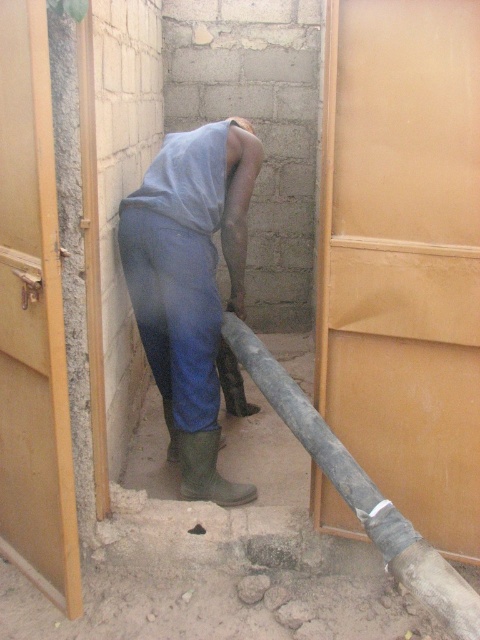
Question: Can you confirm if rusty metallic pipe at center is positioned to the right of green rubber boot at lower center?

Choices:
 (A) no
 (B) yes

Answer: (B)

Question: Which of the following is the closest to the observer?

Choices:
 (A) rusty metallic pipe at center
 (B) blue denim pants at center
 (C) smooth concrete hole at lower center
 (D) green rubber boot at lower center

Answer: (A)

Question: Estimate the real-world distances between objects in this image. Which object is closer to the rusty metallic pipe at center?

Choices:
 (A) smooth concrete hole at lower center
 (B) blue denim pants at center

Answer: (B)

Question: Can you confirm if blue denim pants at center is smaller than green rubber boot at lower center?

Choices:
 (A) no
 (B) yes

Answer: (A)

Question: Among these objects, which one is farthest from the camera?

Choices:
 (A) rusty metallic pipe at center
 (B) green rubber boot at lower center

Answer: (B)

Question: Can you confirm if rusty metallic pipe at center is positioned to the left of smooth concrete hole at lower center?

Choices:
 (A) yes
 (B) no

Answer: (B)